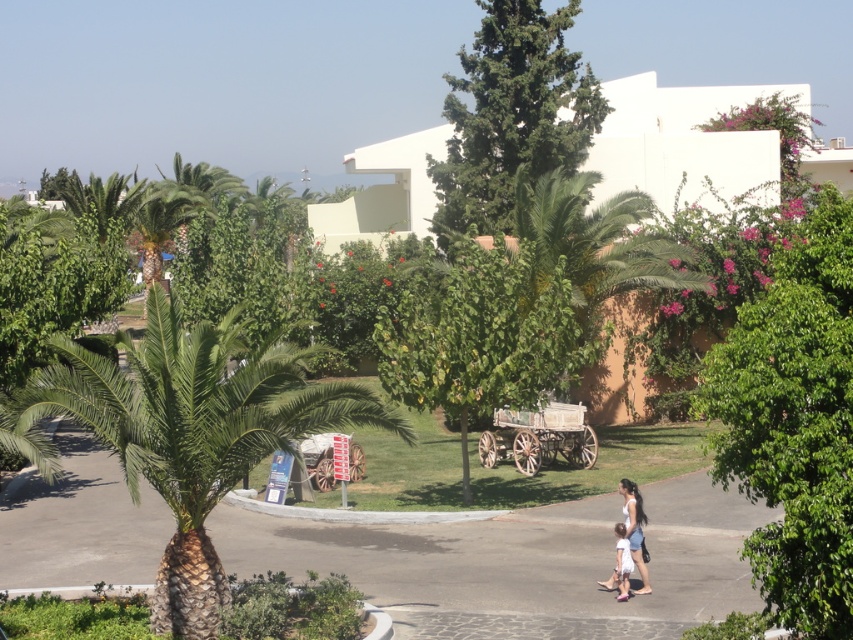
Question: Based on their relative distances, which object is nearer to the white cotton dress at lower right?

Choices:
 (A) green leafy palm at center
 (B) smooth asphalt road at center
 (C) green leafy tree at upper center
 (D) light blue denim dress at lower center

Answer: (D)

Question: From the image, what is the correct spatial relationship of smooth asphalt road at center in relation to green leafy tree at upper center?

Choices:
 (A) right
 (B) left

Answer: (B)

Question: Does green leafy palm at center have a larger size compared to green leafy tree at center?

Choices:
 (A) yes
 (B) no

Answer: (B)

Question: Is green leafy tree at right behind green leafy palm at center?

Choices:
 (A) yes
 (B) no

Answer: (B)

Question: Which point appears farthest from the camera in this image?

Choices:
 (A) (502, 192)
 (B) (172, 358)
 (C) (421, 596)
 (D) (628, 548)

Answer: (A)

Question: Which point is farther to the camera?

Choices:
 (A) light blue denim dress at lower center
 (B) green leafy tree at upper center
 (C) green leafy palm at center

Answer: (B)